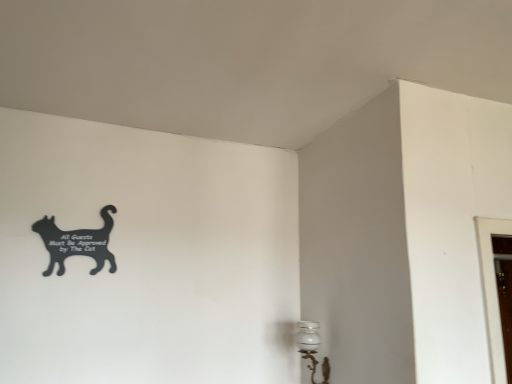
Image resolution: width=512 pixels, height=384 pixels. What do you see at coordinates (308, 343) in the screenshot?
I see `white glossy lamp at lower right` at bounding box center [308, 343].

At what (x,y) coordinates should I click in order to perform the action: click on white glossy lamp at lower right. Please return your answer as a coordinate pair (x, y). Looking at the image, I should click on (308, 343).

What is the approximate height of white glossy lamp at lower right?

14.09 inches.

You are a GUI agent. You are given a task and a screenshot of the screen. Output one action in this format:
    pyautogui.click(x=<x>, y=<y>)
    Task: Click on the black matte sign at upper left
    This screenshot has width=512, height=384.
    Given the screenshot: What is the action you would take?
    pyautogui.click(x=77, y=243)

What do you see at coordinates (77, 243) in the screenshot? This screenshot has width=512, height=384. I see `black matte sign at upper left` at bounding box center [77, 243].

I want to click on white glossy lamp at lower right, so click(308, 343).

Consider the image. Which object is positioned more to the left, black matte sign at upper left or white glossy lamp at lower right?

From the viewer's perspective, black matte sign at upper left appears more on the left side.

Is the depth of black matte sign at upper left greater than that of white glossy lamp at lower right?

Yes.

Considering the positions of point (100, 250) and point (322, 371), is point (100, 250) closer or farther from the camera than point (322, 371)?

Clearly, point (100, 250) is closer to the camera than point (322, 371).

From the image's perspective, would you say black matte sign at upper left is positioned over white glossy lamp at lower right?

Yes.

From a real-world perspective, who is located higher, black matte sign at upper left or white glossy lamp at lower right?

From a 3D spatial view, black matte sign at upper left is above.

Which object is thinner, black matte sign at upper left or white glossy lamp at lower right?

black matte sign at upper left is thinner.

From their relative heights in the image, would you say black matte sign at upper left is taller or shorter than white glossy lamp at lower right?

black matte sign at upper left is shorter than white glossy lamp at lower right.

Between black matte sign at upper left and white glossy lamp at lower right, which one has larger size?

With larger size is white glossy lamp at lower right.

Would you say white glossy lamp at lower right is part of black matte sign at upper left's contents?

No.

Would you consider black matte sign at upper left to be distant from white glossy lamp at lower right?

Yes.

Is black matte sign at upper left oriented away from white glossy lamp at lower right?

No.

Measure the distance between black matte sign at upper left and white glossy lamp at lower right.

black matte sign at upper left and white glossy lamp at lower right are 1.08 meters apart from each other.

The image size is (512, 384). What are the coordinates of `lamp below the black matte sign at upper left (from the image's perspective)` in the screenshot? It's located at (308, 343).

Is white glossy lamp at lower right to the left or to the right of black matte sign at upper left in the image?

white glossy lamp at lower right is to the right of black matte sign at upper left.

Which object is more forward, white glossy lamp at lower right or black matte sign at upper left?

white glossy lamp at lower right.

Between point (303, 336) and point (89, 237), which one is positioned behind?

The point (89, 237) is behind.

In the scene shown: From the image's perspective, is white glossy lamp at lower right located above or below black matte sign at upper left?

→ white glossy lamp at lower right is situated lower than black matte sign at upper left in the image.

From a real-world perspective, which is physically above, white glossy lamp at lower right or black matte sign at upper left?

black matte sign at upper left is physically above.

Is white glossy lamp at lower right wider than black matte sign at upper left?

Indeed, white glossy lamp at lower right has a greater width compared to black matte sign at upper left.

Considering the relative sizes of white glossy lamp at lower right and black matte sign at upper left in the image provided, is white glossy lamp at lower right shorter than black matte sign at upper left?

Incorrect, the height of white glossy lamp at lower right does not fall short of that of black matte sign at upper left.

Considering the relative sizes of white glossy lamp at lower right and black matte sign at upper left in the image provided, is white glossy lamp at lower right smaller than black matte sign at upper left?

No.

Consider the image. Is white glossy lamp at lower right spatially inside black matte sign at upper left, or outside of it?

white glossy lamp at lower right lies outside black matte sign at upper left.

Is white glossy lamp at lower right next to black matte sign at upper left and touching it?

No, white glossy lamp at lower right is not with black matte sign at upper left.

Is white glossy lamp at lower right oriented away from black matte sign at upper left?

white glossy lamp at lower right is not turned away from black matte sign at upper left.

How different are the orientations of white glossy lamp at lower right and black matte sign at upper left in degrees?

88.5 degrees separate the facing orientations of white glossy lamp at lower right and black matte sign at upper left.

Where is `lamp to the right of black matte sign at upper left`? Image resolution: width=512 pixels, height=384 pixels. lamp to the right of black matte sign at upper left is located at coordinates (308, 343).

The image size is (512, 384). In order to click on lamp below the black matte sign at upper left (from a real-world perspective) in this screenshot , I will do `click(308, 343)`.

The width and height of the screenshot is (512, 384). I want to click on lamp in front of the black matte sign at upper left, so click(x=308, y=343).